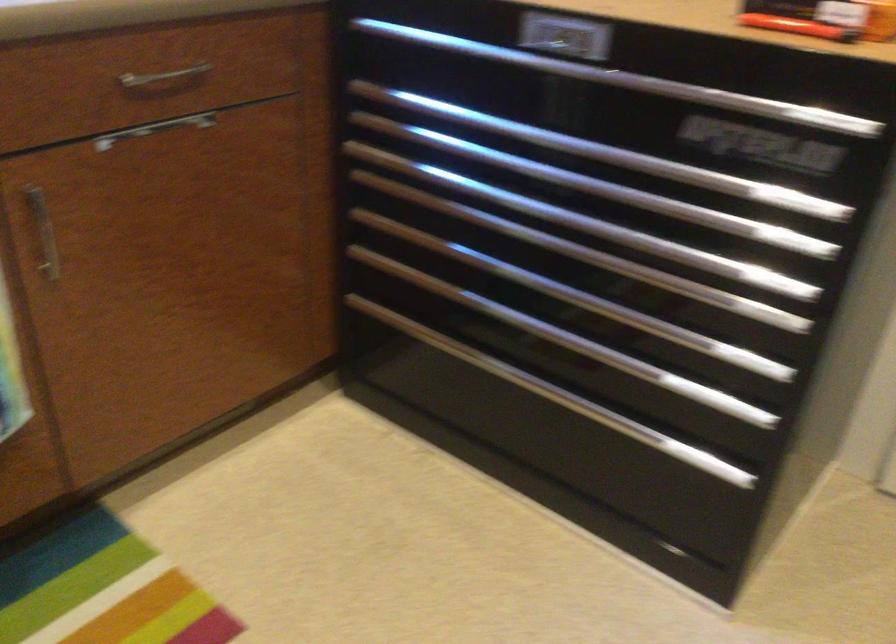
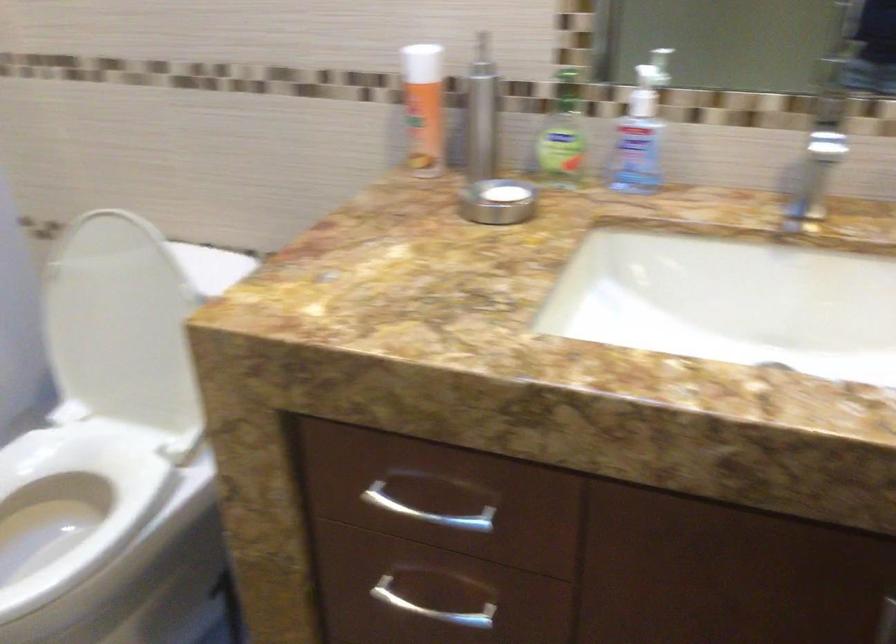
In a continuous first-person perspective shot, in which direction is the camera moving?

The movement direction of the cameraman is right, backward.